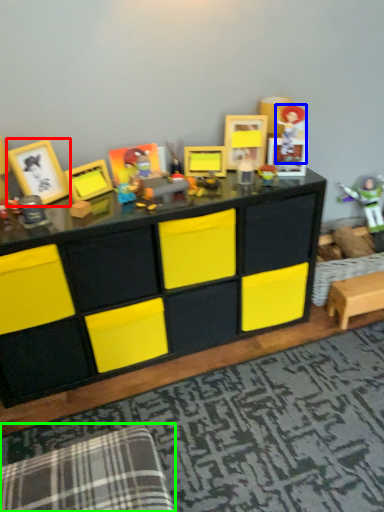
Question: Which object is the closest to the picture frame (highlighted by a red box)? Choose among these: toy (highlighted by a blue box) or swivel chair (highlighted by a green box).

Choices:
 (A) toy
 (B) swivel chair

Answer: (A)